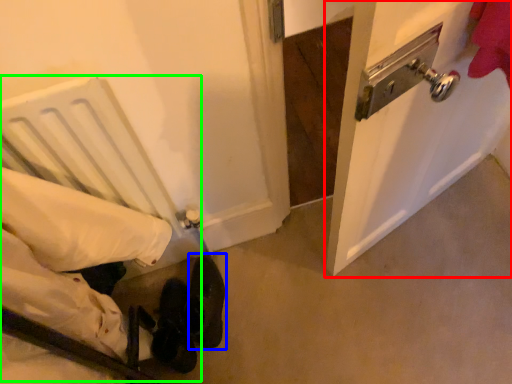
Question: Which object is the farthest from door (highlighted by a red box)? Choose among these: footwear (highlighted by a blue box) or bed (highlighted by a green box).

Choices:
 (A) footwear
 (B) bed

Answer: (A)